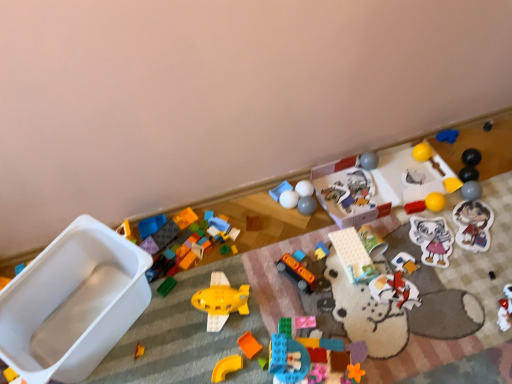
Question: In which direction should I rotate to look at matte plastic blocks at center, the eighth toy positioned from the left?

Choices:
 (A) left
 (B) right

Answer: (B)

Question: Is white matte ball at center, placed as the thirteenth toy when sorted from left to right, taller than yellow rubber ball at upper right, which is counted as the 5th toy, starting from the right?

Choices:
 (A) no
 (B) yes

Answer: (B)

Question: Can you confirm if white matte ball at center, placed as the 13th toy when sorted from right to left, is positioned to the right of yellow rubber ball at upper right, the 21th toy in the left-to-right sequence?

Choices:
 (A) no
 (B) yes

Answer: (A)

Question: Considering the relative sizes of white matte ball at center, placed as the thirteenth toy when sorted from left to right, and yellow rubber ball at upper right, which is counted as the 5th toy, starting from the right, in the image provided, is white matte ball at center, placed as the thirteenth toy when sorted from left to right, wider than yellow rubber ball at upper right, which is counted as the 5th toy, starting from the right,?

Choices:
 (A) yes
 (B) no

Answer: (B)

Question: Does white matte ball at center, placed as the thirteenth toy when sorted from left to right, have a lesser height compared to yellow rubber ball at upper right, the 21th toy in the left-to-right sequence?

Choices:
 (A) yes
 (B) no

Answer: (B)

Question: Would you say white matte ball at center, placed as the thirteenth toy when sorted from left to right, is outside yellow rubber ball at upper right, which is counted as the 5th toy, starting from the right?

Choices:
 (A) yes
 (B) no

Answer: (A)

Question: Does white matte ball at center, placed as the thirteenth toy when sorted from left to right, turn towards yellow rubber ball at upper right, the 21th toy in the left-to-right sequence?

Choices:
 (A) no
 (B) yes

Answer: (A)

Question: From the image's perspective, would you say pink matte block at center, acting as the 14th toy starting from the right, is shown under translucent plastic toy airplane at center, the sixteenth toy from the left?

Choices:
 (A) yes
 (B) no

Answer: (A)

Question: Can you confirm if pink matte block at center, acting as the 14th toy starting from the right, is positioned to the left of translucent plastic toy airplane at center, arranged as the tenth toy when viewed from the right?

Choices:
 (A) yes
 (B) no

Answer: (A)

Question: Considering the relative sizes of pink matte block at center, acting as the 14th toy starting from the right, and translucent plastic toy airplane at center, arranged as the tenth toy when viewed from the right, in the image provided, is pink matte block at center, acting as the 14th toy starting from the right, shorter than translucent plastic toy airplane at center, arranged as the tenth toy when viewed from the right,?

Choices:
 (A) no
 (B) yes

Answer: (B)

Question: From the image's perspective, would you say pink matte block at center, the twelfth toy viewed from the left, is positioned over translucent plastic toy airplane at center, arranged as the tenth toy when viewed from the right?

Choices:
 (A) no
 (B) yes

Answer: (A)

Question: Is pink matte block at center, acting as the 14th toy starting from the right, not within translucent plastic toy airplane at center, arranged as the tenth toy when viewed from the right?

Choices:
 (A) yes
 (B) no

Answer: (A)

Question: Are pink matte block at center, the twelfth toy viewed from the left, and translucent plastic toy airplane at center, the sixteenth toy from the left, beside each other?

Choices:
 (A) no
 (B) yes

Answer: (A)

Question: From the image's perspective, would you say yellow plastic curve at center, the fifth toy in the left-to-right sequence, is shown under matte plastic blocks at center, the eighth toy positioned from the left?

Choices:
 (A) yes
 (B) no

Answer: (A)